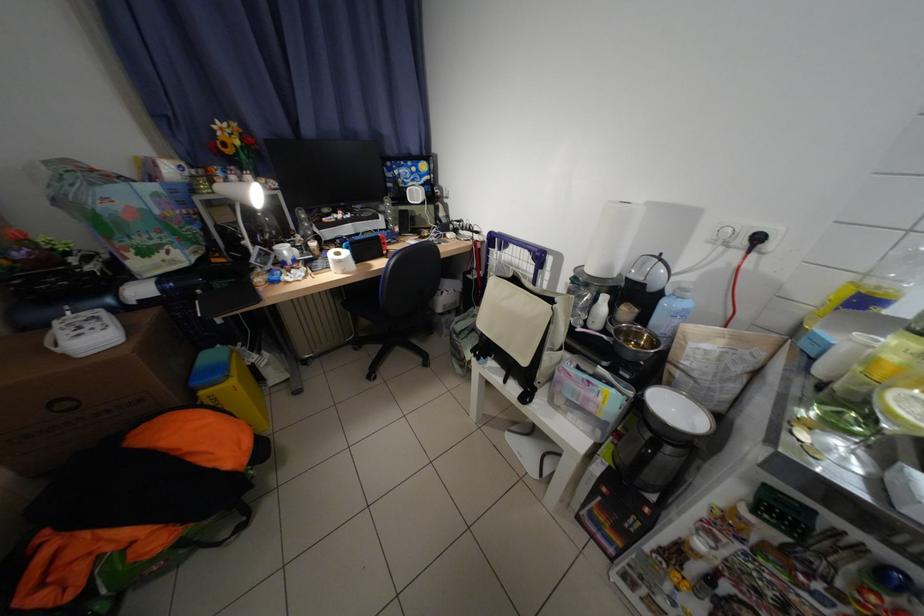
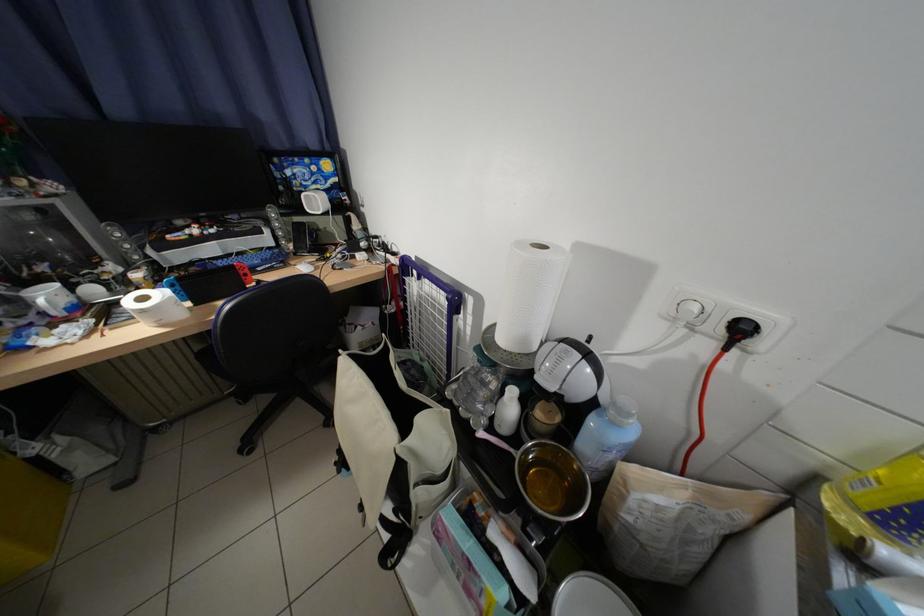
Find the pixel in the second image that matches point (770, 240) in the first image.

(754, 331)